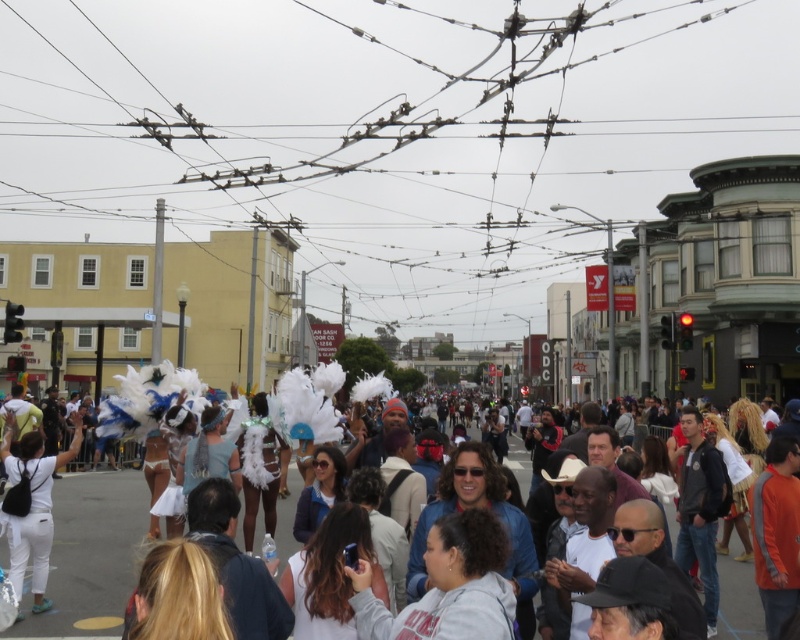
Is metallic wires at center shorter than white matte backpack at lower left?

In fact, metallic wires at center may be taller than white matte backpack at lower left.

Can you confirm if metallic wires at center is positioned below white matte backpack at lower left?

No, metallic wires at center is not below white matte backpack at lower left.

Between point (470, 97) and point (36, 609), which one is positioned in front?

Point (36, 609)

At what (x,y) coordinates should I click in order to perform the action: click on metallic wires at center. Please return your answer as a coordinate pair (x, y). The height and width of the screenshot is (640, 800). Looking at the image, I should click on (389, 154).

Is metallic wires at center taller than white feathered costumes at center?

Yes.

Measure the distance between point [702,148] and camera.

Point [702,148] is 1093.60 feet from camera.

Where is `metallic wires at center`? metallic wires at center is located at coordinates (389, 154).

Between white feathered costumes at center and white matte backpack at lower left, which one appears on the left side from the viewer's perspective?

Positioned to the left is white matte backpack at lower left.

Where is `white feathered costumes at center`? white feathered costumes at center is located at coordinates (90, 554).

Who is more distant from viewer, (78, 630) or (10, 548)?

Positioned behind is point (10, 548).

Identify the location of white feathered costumes at center. This screenshot has height=640, width=800. (90, 554).